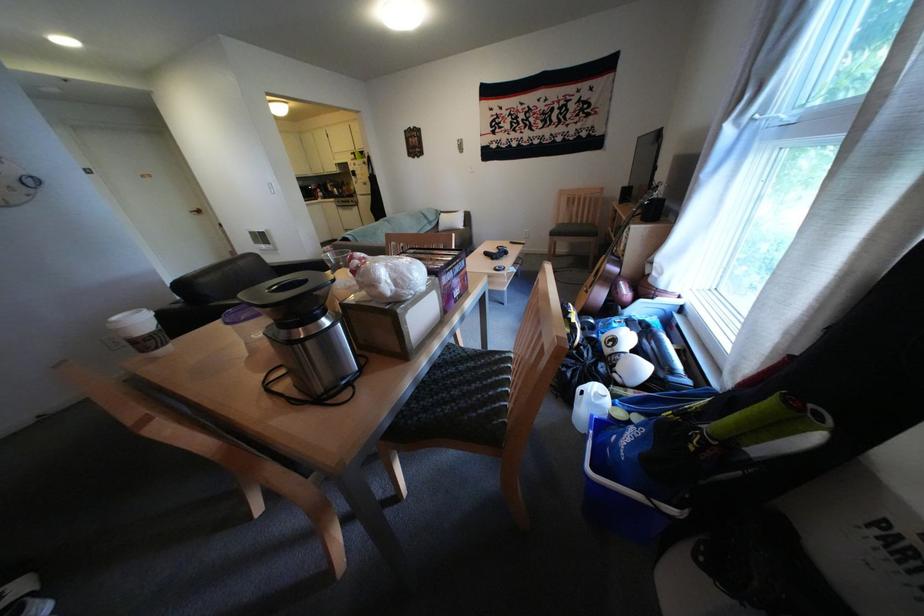
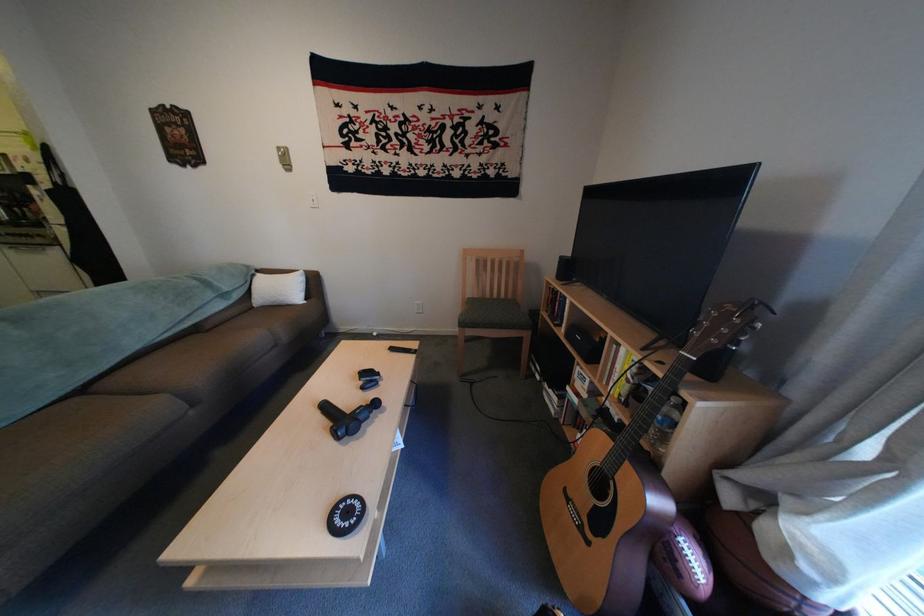
Question: In a continuous first-person perspective shot, in which direction is the camera moving?

Choices:
 (A) Left
 (B) Right
 (C) Forward
 (D) Backward

Answer: (C)